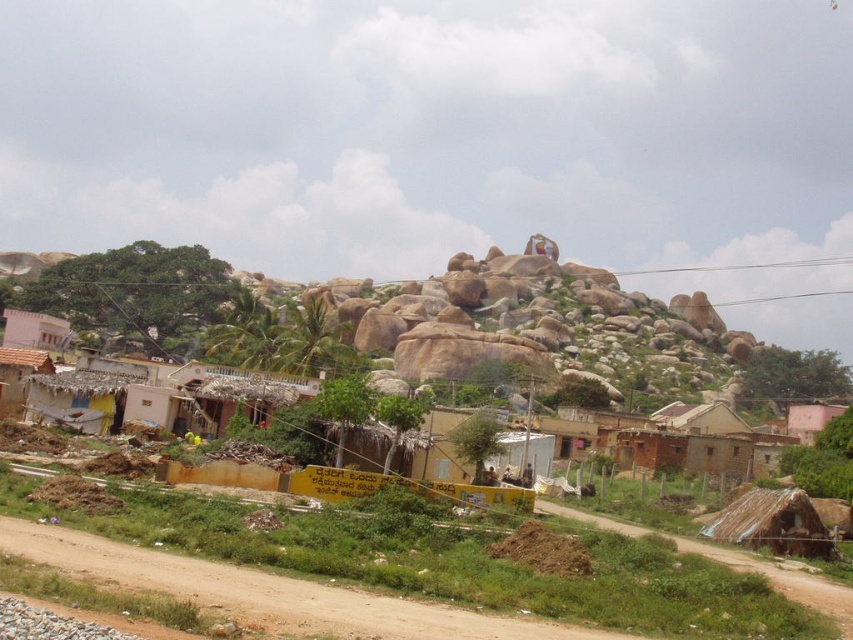
Does brown dirt track at lower left appear over light pink painted wall at lower left?

Actually, brown dirt track at lower left is below light pink painted wall at lower left.

Does brown dirt track at lower left come in front of light pink painted wall at lower left?

Yes, brown dirt track at lower left is in front of light pink painted wall at lower left.

Does point (112, 564) lie behind point (44, 314)?

No, it is in front of (44, 314).

Find the location of a particular element. brown dirt track at lower left is located at coordinates (273, 592).

Which of these two, rusty corrugated hut at lower right or light pink painted wall at lower left, stands shorter?

rusty corrugated hut at lower right

Does rusty corrugated hut at lower right have a larger size compared to light pink painted wall at lower left?

No, rusty corrugated hut at lower right is not bigger than light pink painted wall at lower left.

Identify the location of rusty corrugated hut at lower right. Image resolution: width=853 pixels, height=640 pixels. (772, 524).

Locate an element on the screen. This screenshot has height=640, width=853. rusty corrugated hut at lower right is located at coordinates (772, 524).

Does brown dirt track at lower left appear over rusty corrugated hut at lower right?

Indeed, brown dirt track at lower left is positioned over rusty corrugated hut at lower right.

Who is lower down, brown dirt track at lower left or rusty corrugated hut at lower right?

rusty corrugated hut at lower right

At what (x,y) coordinates should I click in order to perform the action: click on brown dirt track at lower left. Please return your answer as a coordinate pair (x, y). This screenshot has width=853, height=640. Looking at the image, I should click on (273, 592).